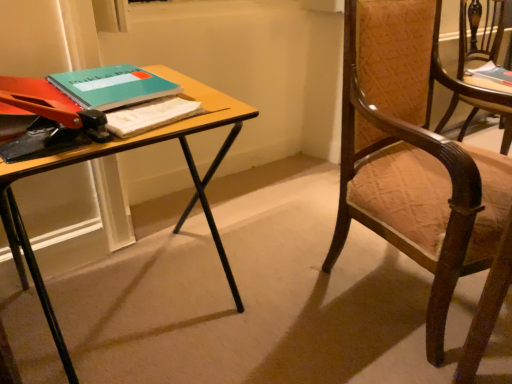
In order to click on vacant area that is situated to the right of wooden desk at center in this screenshot , I will do `click(292, 332)`.